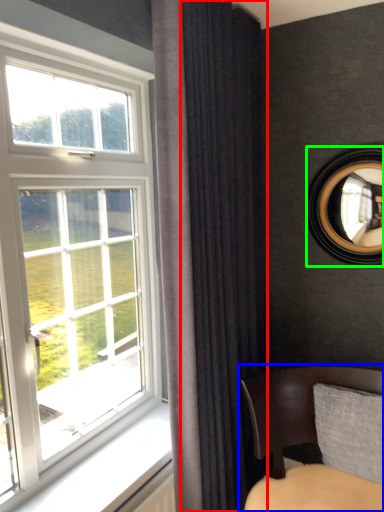
Question: Which object is positioned farthest from curtain (highlighted by a red box)? Select from chair (highlighted by a blue box) and mirror (highlighted by a green box).

Choices:
 (A) chair
 (B) mirror

Answer: (B)